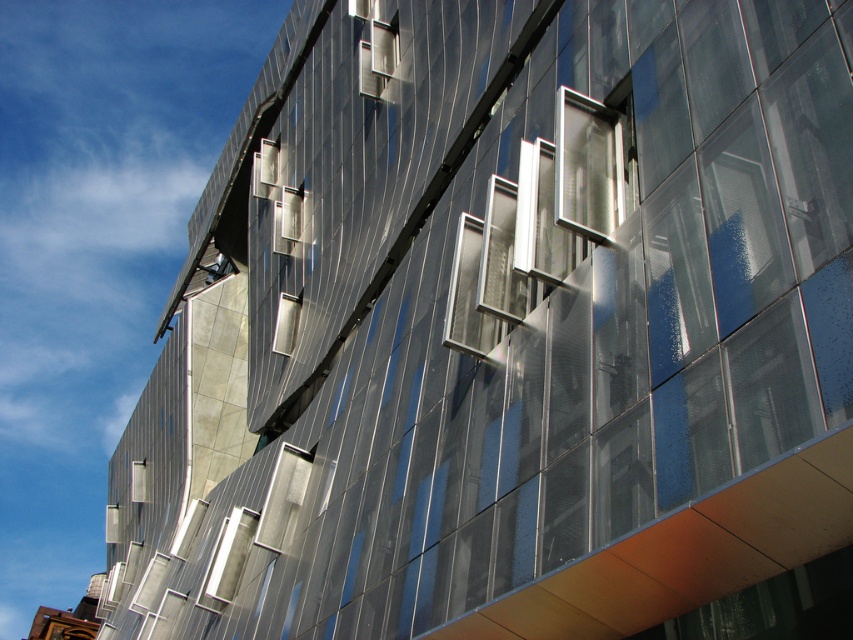
Is clear glass window at center wider than metallic silver window at center?

Yes.

Who is higher up, clear glass window at center or metallic silver window at center?

clear glass window at center is above.

Is point (585, 99) in front of point (222, 529)?

Yes, it is.

Find the location of a particular element. This screenshot has height=640, width=853. clear glass window at center is located at coordinates (537, 221).

The image size is (853, 640). What do you see at coordinates (227, 560) in the screenshot? I see `metallic silver window at center` at bounding box center [227, 560].

Is point (225, 557) in front of point (387, 70)?

Yes.

Is point (215, 582) less distant than point (363, 64)?

Yes.

Identify the location of metallic silver window at center. [227, 560].

Is the position of clear glass window at center less distant than that of metallic silver window at upper center?

Yes.

Identify the location of clear glass window at center. This screenshot has width=853, height=640. (537, 221).

The image size is (853, 640). I want to click on clear glass window at center, so click(537, 221).